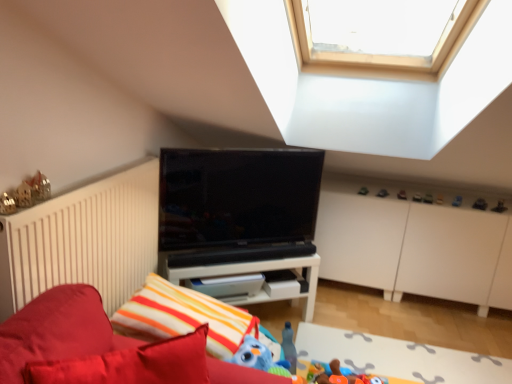
The height and width of the screenshot is (384, 512). Identify the location of unoccupied space behind smooth plastic toy at upper right, which ranks as the 5th toy in right-to-left order. (421, 191).